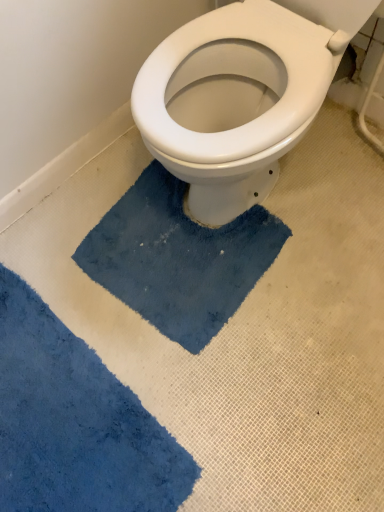
Describe the element at coordinates (75, 423) in the screenshot. I see `blue soft rug at lower left, the second bath mat positioned from the top` at that location.

Locate an element on the screen. This screenshot has height=512, width=384. blue soft rug at lower left, the second bath mat positioned from the top is located at coordinates (75, 423).

Measure the distance between point (254, 228) and camera.

Point (254, 228) is 1.20 meters away from camera.

This screenshot has width=384, height=512. I want to click on blue plush bath mat at center, which is the second bath mat in bottom-to-top order, so click(x=178, y=258).

The image size is (384, 512). What do you see at coordinates (178, 258) in the screenshot?
I see `blue plush bath mat at center, which is the first bath mat in top-to-bottom order` at bounding box center [178, 258].

This screenshot has height=512, width=384. What are the coordinates of `blue soft rug at lower left, the second bath mat positioned from the top` in the screenshot? It's located at (75, 423).

Considering the positions of objects blue plush bath mat at center, which is the first bath mat in top-to-bottom order, and blue soft rug at lower left, the first bath mat from the bottom, in the image provided, who is more to the right, blue plush bath mat at center, which is the first bath mat in top-to-bottom order, or blue soft rug at lower left, the first bath mat from the bottom,?

From the viewer's perspective, blue plush bath mat at center, which is the first bath mat in top-to-bottom order, appears more on the right side.

Based on the photo, considering the relative positions of blue plush bath mat at center, which is the first bath mat in top-to-bottom order, and blue soft rug at lower left, the second bath mat positioned from the top, in the image provided, is blue plush bath mat at center, which is the first bath mat in top-to-bottom order, in front of blue soft rug at lower left, the second bath mat positioned from the top,?

No, it is behind blue soft rug at lower left, the second bath mat positioned from the top.

Does point (171, 253) appear closer or farther from the camera than point (34, 409)?

Clearly, point (171, 253) is more distant from the camera than point (34, 409).

From the image's perspective, is blue plush bath mat at center, which is the second bath mat in bottom-to-top order, above blue soft rug at lower left, the second bath mat positioned from the top?

Yes, from the image's perspective, blue plush bath mat at center, which is the second bath mat in bottom-to-top order, is on top of blue soft rug at lower left, the second bath mat positioned from the top.

From a real-world perspective, between blue plush bath mat at center, which is the second bath mat in bottom-to-top order, and blue soft rug at lower left, the first bath mat from the bottom, who is vertically higher?

From a 3D spatial view, blue plush bath mat at center, which is the second bath mat in bottom-to-top order, is above.

Considering the sizes of objects blue plush bath mat at center, which is the first bath mat in top-to-bottom order, and blue soft rug at lower left, the first bath mat from the bottom, in the image provided, who is wider, blue plush bath mat at center, which is the first bath mat in top-to-bottom order, or blue soft rug at lower left, the first bath mat from the bottom,?

With larger width is blue plush bath mat at center, which is the first bath mat in top-to-bottom order.

Is blue plush bath mat at center, which is the first bath mat in top-to-bottom order, taller or shorter than blue soft rug at lower left, the first bath mat from the bottom?

Clearly, blue plush bath mat at center, which is the first bath mat in top-to-bottom order, is taller compared to blue soft rug at lower left, the first bath mat from the bottom.

Does blue plush bath mat at center, which is the first bath mat in top-to-bottom order, have a larger size compared to blue soft rug at lower left, the second bath mat positioned from the top?

Incorrect, blue plush bath mat at center, which is the first bath mat in top-to-bottom order, is not larger than blue soft rug at lower left, the second bath mat positioned from the top.

Is blue plush bath mat at center, which is the first bath mat in top-to-bottom order, outside of blue soft rug at lower left, the second bath mat positioned from the top?

Yes, blue plush bath mat at center, which is the first bath mat in top-to-bottom order, is outside of blue soft rug at lower left, the second bath mat positioned from the top.

Can you see blue plush bath mat at center, which is the first bath mat in top-to-bottom order, touching blue soft rug at lower left, the second bath mat positioned from the top?

No, blue plush bath mat at center, which is the first bath mat in top-to-bottom order, is not next to blue soft rug at lower left, the second bath mat positioned from the top.

Could you tell me if blue plush bath mat at center, which is the first bath mat in top-to-bottom order, is turned towards blue soft rug at lower left, the second bath mat positioned from the top?

Yes, blue plush bath mat at center, which is the first bath mat in top-to-bottom order, is oriented towards blue soft rug at lower left, the second bath mat positioned from the top.

Measure the distance between blue plush bath mat at center, which is the second bath mat in bottom-to-top order, and blue soft rug at lower left, the second bath mat positioned from the top.

They are 12.75 inches apart.

Identify the location of bath mat that is under the blue plush bath mat at center, which is the second bath mat in bottom-to-top order (from a real-world perspective). This screenshot has height=512, width=384. (75, 423).

Is blue soft rug at lower left, the first bath mat from the bottom, at the right side of blue plush bath mat at center, which is the second bath mat in bottom-to-top order?

No, blue soft rug at lower left, the first bath mat from the bottom, is not to the right of blue plush bath mat at center, which is the second bath mat in bottom-to-top order.

Considering the positions of objects blue soft rug at lower left, the second bath mat positioned from the top, and blue plush bath mat at center, which is the first bath mat in top-to-bottom order, in the image provided, who is behind, blue soft rug at lower left, the second bath mat positioned from the top, or blue plush bath mat at center, which is the first bath mat in top-to-bottom order,?

blue plush bath mat at center, which is the first bath mat in top-to-bottom order, is more distant.

Considering the points (117, 458) and (154, 238), which point is in front, point (117, 458) or point (154, 238)?

The point (117, 458) is closer.

From the image's perspective, between blue soft rug at lower left, the second bath mat positioned from the top, and blue plush bath mat at center, which is the second bath mat in bottom-to-top order, who is located below?

blue soft rug at lower left, the second bath mat positioned from the top, is shown below in the image.

Consider the image. From a real-world perspective, is blue soft rug at lower left, the first bath mat from the bottom, located beneath blue plush bath mat at center, which is the second bath mat in bottom-to-top order?

Yes.

Based on the photo, is blue soft rug at lower left, the second bath mat positioned from the top, thinner than blue plush bath mat at center, which is the first bath mat in top-to-bottom order?

Correct, the width of blue soft rug at lower left, the second bath mat positioned from the top, is less than that of blue plush bath mat at center, which is the first bath mat in top-to-bottom order.

Can you confirm if blue soft rug at lower left, the second bath mat positioned from the top, is shorter than blue plush bath mat at center, which is the first bath mat in top-to-bottom order?

Yes, blue soft rug at lower left, the second bath mat positioned from the top, is shorter than blue plush bath mat at center, which is the first bath mat in top-to-bottom order.

Which of these two, blue soft rug at lower left, the first bath mat from the bottom, or blue plush bath mat at center, which is the first bath mat in top-to-bottom order, is bigger?

blue soft rug at lower left, the first bath mat from the bottom, is bigger.

Is blue soft rug at lower left, the second bath mat positioned from the top, not within blue plush bath mat at center, which is the second bath mat in bottom-to-top order?

Yes, blue soft rug at lower left, the second bath mat positioned from the top, is outside of blue plush bath mat at center, which is the second bath mat in bottom-to-top order.

Is blue soft rug at lower left, the first bath mat from the bottom, not close to blue plush bath mat at center, which is the second bath mat in bottom-to-top order?

No, there isn't a large distance between blue soft rug at lower left, the first bath mat from the bottom, and blue plush bath mat at center, which is the second bath mat in bottom-to-top order.

Is blue soft rug at lower left, the second bath mat positioned from the top, oriented away from blue plush bath mat at center, which is the second bath mat in bottom-to-top order?

Yes, blue soft rug at lower left, the second bath mat positioned from the top, is facing away from blue plush bath mat at center, which is the second bath mat in bottom-to-top order.

Looking at this image, what's the angular difference between blue soft rug at lower left, the second bath mat positioned from the top, and blue plush bath mat at center, which is the first bath mat in top-to-bottom order,'s facing directions?

The facing directions of blue soft rug at lower left, the second bath mat positioned from the top, and blue plush bath mat at center, which is the first bath mat in top-to-bottom order, are 7.64 degrees apart.

Find the location of `bath mat on the left of blue plush bath mat at center, which is the second bath mat in bottom-to-top order`. bath mat on the left of blue plush bath mat at center, which is the second bath mat in bottom-to-top order is located at coordinates (75, 423).

This screenshot has height=512, width=384. I want to click on bath mat below the blue plush bath mat at center, which is the second bath mat in bottom-to-top order (from the image's perspective), so click(75, 423).

This screenshot has height=512, width=384. I want to click on bath mat above the blue soft rug at lower left, the second bath mat positioned from the top (from the image's perspective), so click(x=178, y=258).